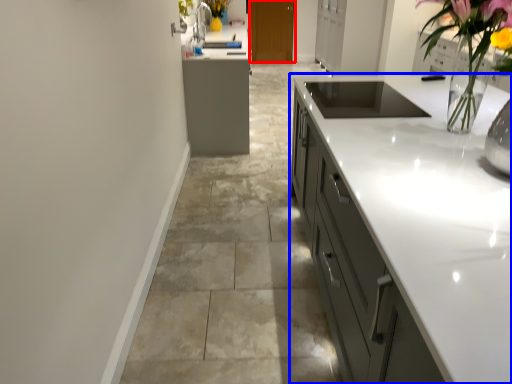
Question: Which of the following is the closest to the observer, cabinetry (highlighted by a red box) or cabinetry (highlighted by a blue box)?

Choices:
 (A) cabinetry
 (B) cabinetry

Answer: (B)